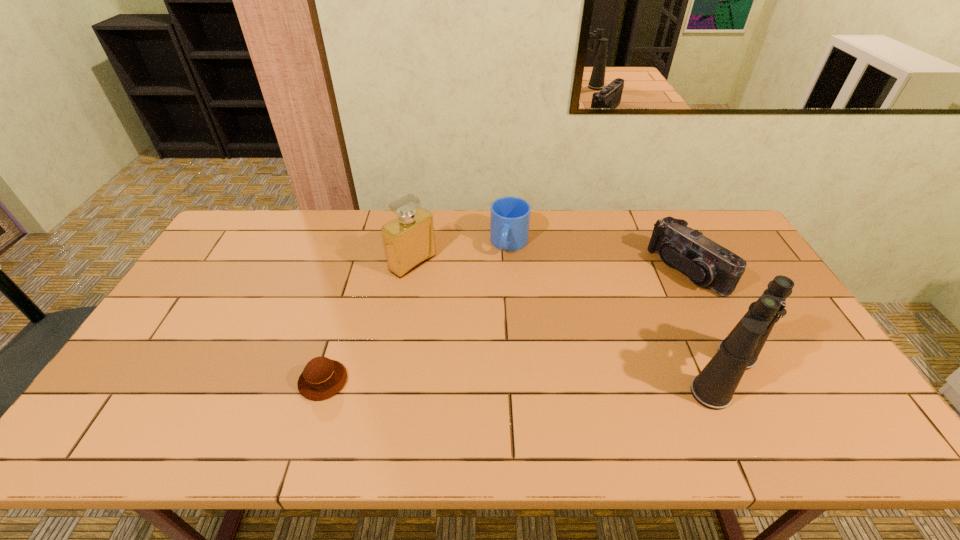
In the image, there is a desktop. Identify the location of vacant space at the far right corner. (699, 217).

I want to click on empty space that is in between the binoculars and the camcorder, so click(705, 322).

You are a GUI agent. You are given a task and a screenshot of the screen. Output one action in this format:
    pyautogui.click(x=<x>, y=<y>)
    Task: Click on the vacant space that's between the third object from left to right and the camcorder
    Image resolution: width=960 pixels, height=540 pixels.
    Given the screenshot: What is the action you would take?
    tap(598, 257)

You are a GUI agent. You are given a task and a screenshot of the screen. Output one action in this format:
    pyautogui.click(x=<x>, y=<y>)
    Task: Click on the free space between the camcorder and the tallest object
    Image resolution: width=960 pixels, height=540 pixels.
    Given the screenshot: What is the action you would take?
    pyautogui.click(x=705, y=322)

The height and width of the screenshot is (540, 960). Identify the location of blank region between the fourth shortest object and the third object from right to left. (461, 253).

The height and width of the screenshot is (540, 960). I want to click on vacant area that lies between the camcorder and the third object from left to right, so click(598, 257).

You are a GUI agent. You are given a task and a screenshot of the screen. Output one action in this format:
    pyautogui.click(x=<x>, y=<y>)
    Task: Click on the unoccupied position between the shortest object and the camcorder
    
    Given the screenshot: What is the action you would take?
    pyautogui.click(x=505, y=326)

Locate an element on the screen. This screenshot has width=960, height=540. vacant space that is in between the camcorder and the perfume is located at coordinates (549, 267).

I want to click on unoccupied position between the fourth shortest object and the shortest object, so click(368, 322).

At what (x,y) coordinates should I click in order to perform the action: click on free space between the shortest object and the binoculars. Please return your answer as a coordinate pair (x, y). Looking at the image, I should click on (523, 377).